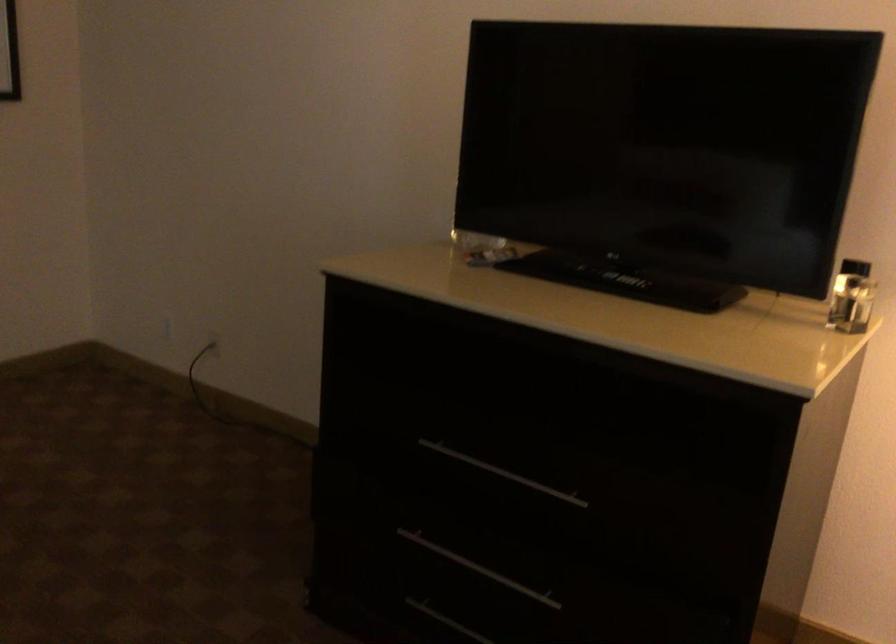
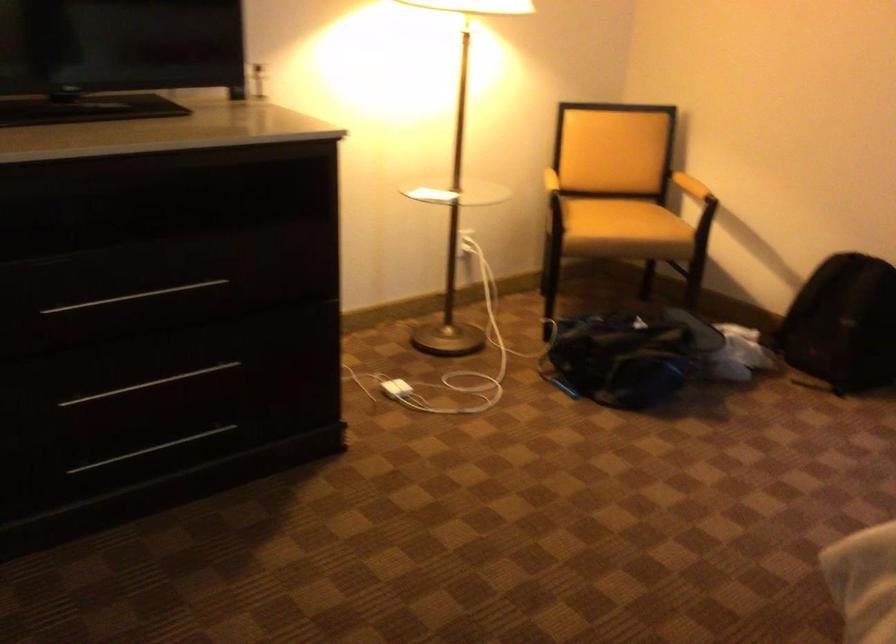
The point at (497, 574) is marked in the first image. Where is the corresponding point in the second image?

(149, 384)